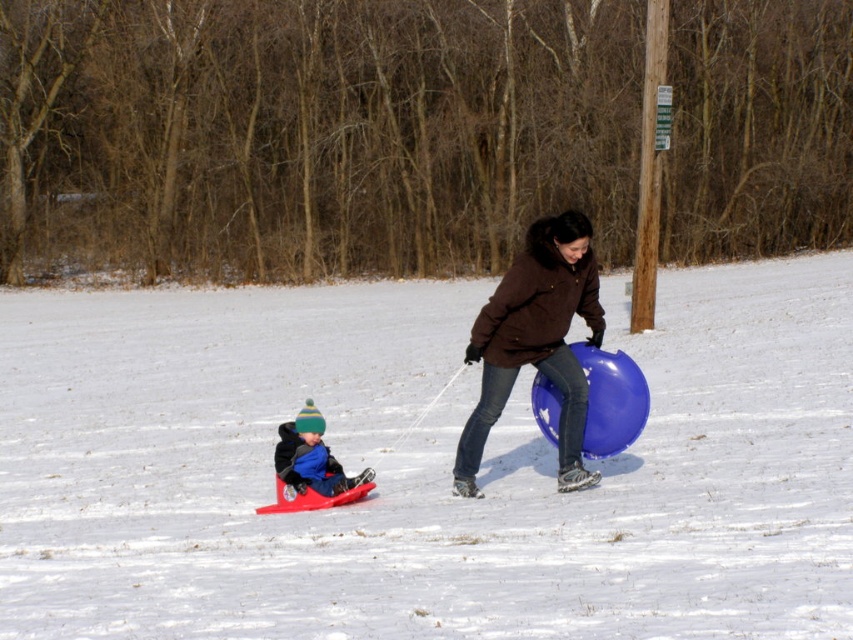
You are standing at the point marked by the coordinates point (422, 467) in the snowy scene. What is the material you are standing on?

You are standing on white matte snow at center, as indicated by the coordinates point (422, 467).

You are standing at the point labeled point (532,328) and want to move towards the point labeled point (283,428). Which direction should you move?

You should move downward and to the right because point (283,428) is located below and to the right of point (532,328).